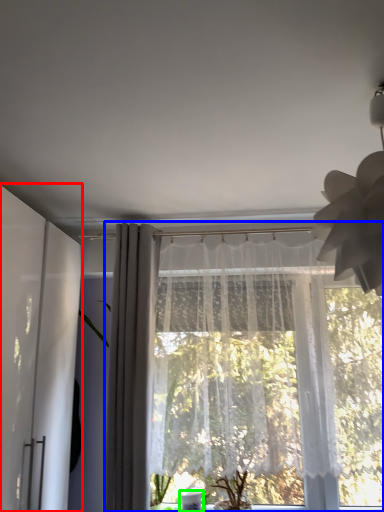
Question: Which is nearer to the screen door (highlighted by a red box)? curtain (highlighted by a blue box) or glass vase (highlighted by a green box).

Choices:
 (A) curtain
 (B) glass vase

Answer: (A)